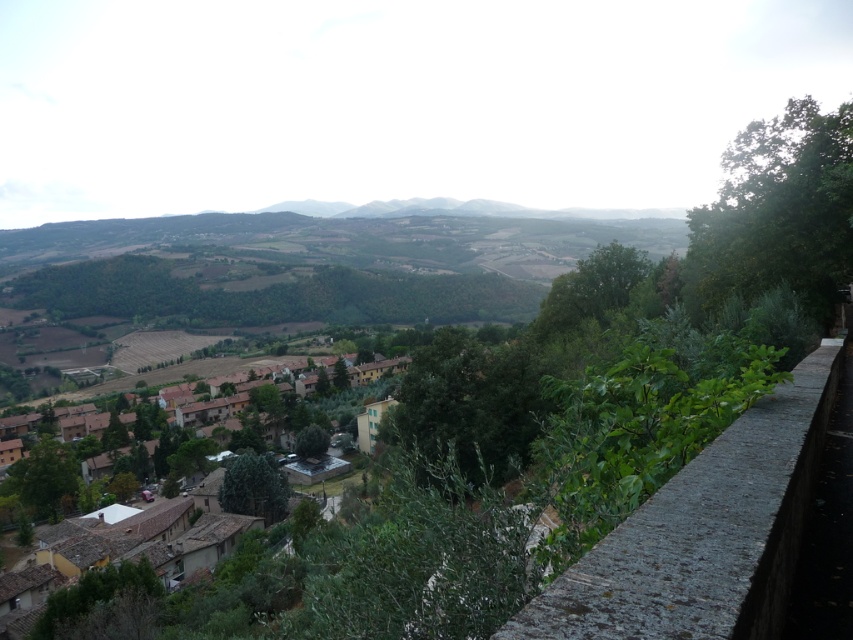
Question: Among these points, which one is farthest from the camera?

Choices:
 (A) (273, 566)
 (B) (811, 456)

Answer: (A)

Question: Does gray stone ledge at right appear on the right side of brown tiled roofs at lower center?

Choices:
 (A) no
 (B) yes

Answer: (B)

Question: Which point is farther to the camera?

Choices:
 (A) (776, 422)
 (B) (247, 557)

Answer: (B)

Question: Can you confirm if gray stone ledge at right is bigger than brown tiled roofs at lower center?

Choices:
 (A) yes
 (B) no

Answer: (B)

Question: Is gray stone ledge at right to the left of brown tiled roofs at lower center from the viewer's perspective?

Choices:
 (A) yes
 (B) no

Answer: (B)